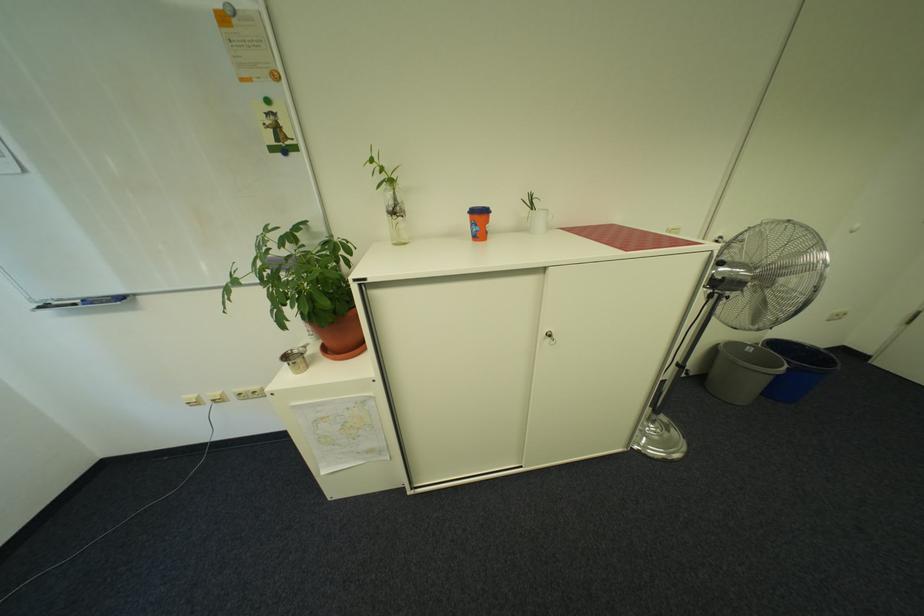
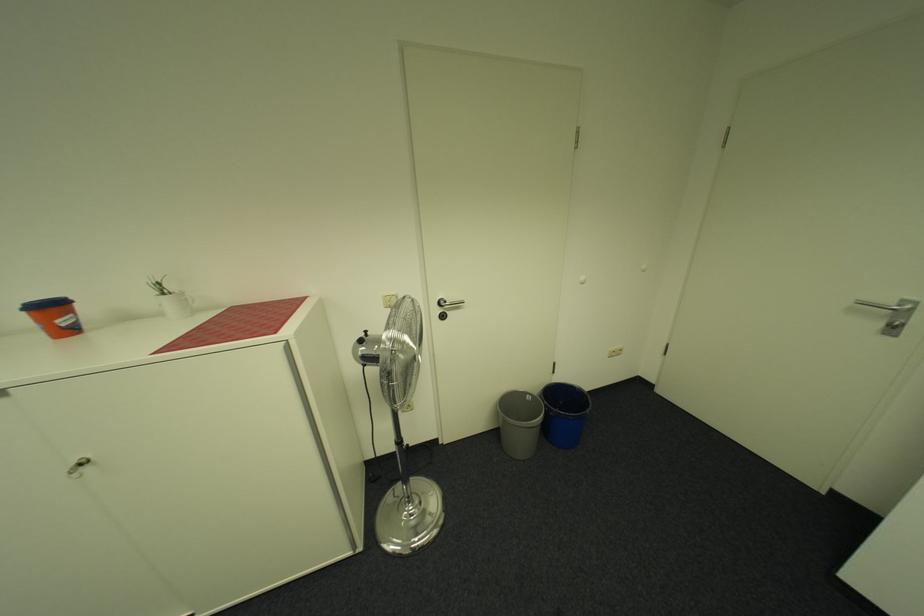
Where in the second image is the point corresponding to the point at 758,347 from the first image?

(538, 397)